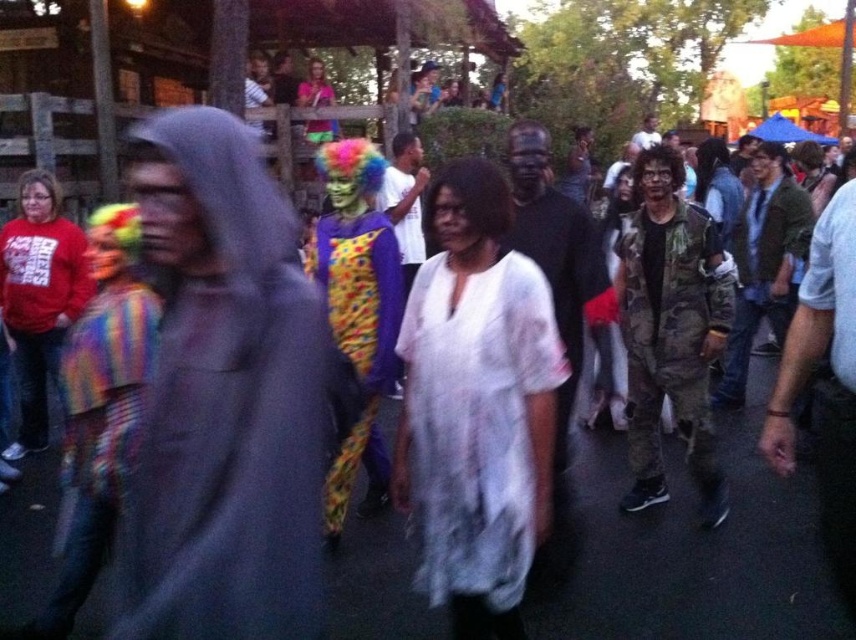
Between multicolored fabric clown at center and matte red sweatshirt at left, which one is positioned higher?

matte red sweatshirt at left

Between multicolored fabric clown at center and matte red sweatshirt at left, which one appears on the right side from the viewer's perspective?

Positioned to the right is multicolored fabric clown at center.

Where is `multicolored fabric clown at center`? This screenshot has height=640, width=856. multicolored fabric clown at center is located at coordinates (357, 304).

The width and height of the screenshot is (856, 640). Identify the location of multicolored fabric clown at center. (357, 304).

Who is higher up, white sheer dress at center or matte pink shirt at upper center?

matte pink shirt at upper center is higher up.

Which is more to the left, white sheer dress at center or matte pink shirt at upper center?

From the viewer's perspective, matte pink shirt at upper center appears more on the left side.

What do you see at coordinates (477, 406) in the screenshot?
I see `white sheer dress at center` at bounding box center [477, 406].

Find the location of `white sheer dress at center`. white sheer dress at center is located at coordinates (477, 406).

Find the location of a particular element. multicolored fabric clown at center is located at coordinates (357, 304).

Is multicolored fabric clown at center smaller than matte pink shirt at upper center?

Yes, multicolored fabric clown at center is smaller than matte pink shirt at upper center.

Locate an element on the screen. Image resolution: width=856 pixels, height=640 pixels. multicolored fabric clown at center is located at coordinates (357, 304).